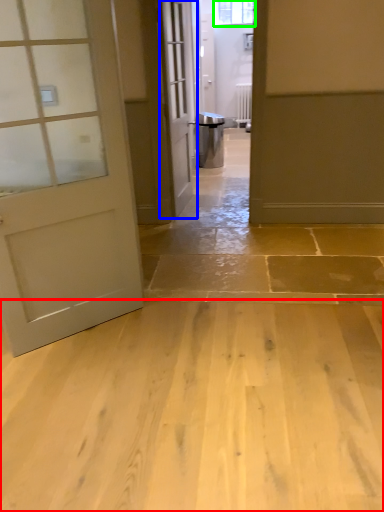
Question: Which object is positioned closest to concrete (highlighted by a red box)? Select from door (highlighted by a blue box) and window (highlighted by a green box).

Choices:
 (A) door
 (B) window

Answer: (A)